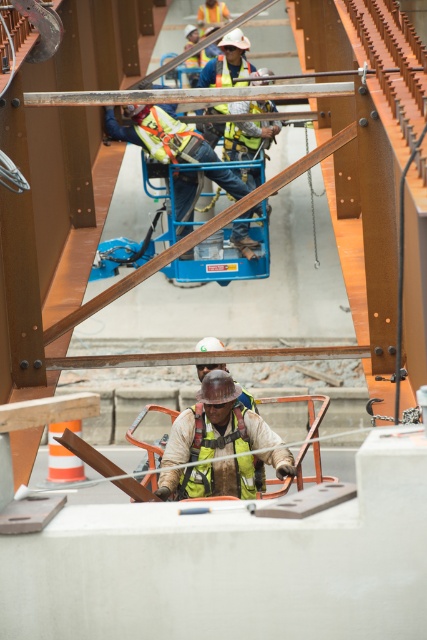
Question: Is reflective yellow safety vest at center to the right of yellow high-visibility safety vest at center from the viewer's perspective?

Choices:
 (A) no
 (B) yes

Answer: (B)

Question: Which point is farther from the camera taking this photo?

Choices:
 (A) (263, 422)
 (B) (233, 433)
 (C) (155, 129)

Answer: (C)

Question: Among these objects, which one is farthest from the camera?

Choices:
 (A) yellow reflective vest at center
 (B) yellow high-visibility safety vest at center

Answer: (A)

Question: Can you confirm if yellow reflective vest at center is thinner than yellow high-visibility safety vest at center?

Choices:
 (A) no
 (B) yes

Answer: (A)

Question: Which of the following is the closest to the observer?

Choices:
 (A) reflective yellow safety vest at center
 (B) yellow reflective vest at center

Answer: (A)

Question: Is reflective yellow safety vest at center positioned in front of yellow reflective vest at center?

Choices:
 (A) no
 (B) yes

Answer: (B)